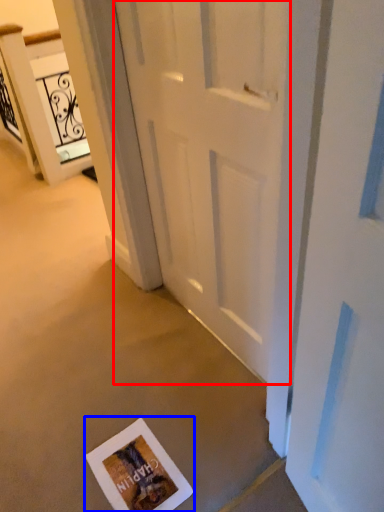
Question: Which of the following is the farthest to the observer, door (highlighted by a red box) or postcard (highlighted by a blue box)?

Choices:
 (A) door
 (B) postcard

Answer: (B)